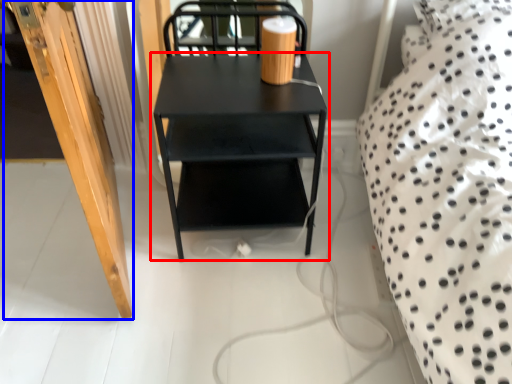
Question: Which object is further to the camera taking this photo, table (highlighted by a red box) or door (highlighted by a blue box)?

Choices:
 (A) table
 (B) door

Answer: (A)